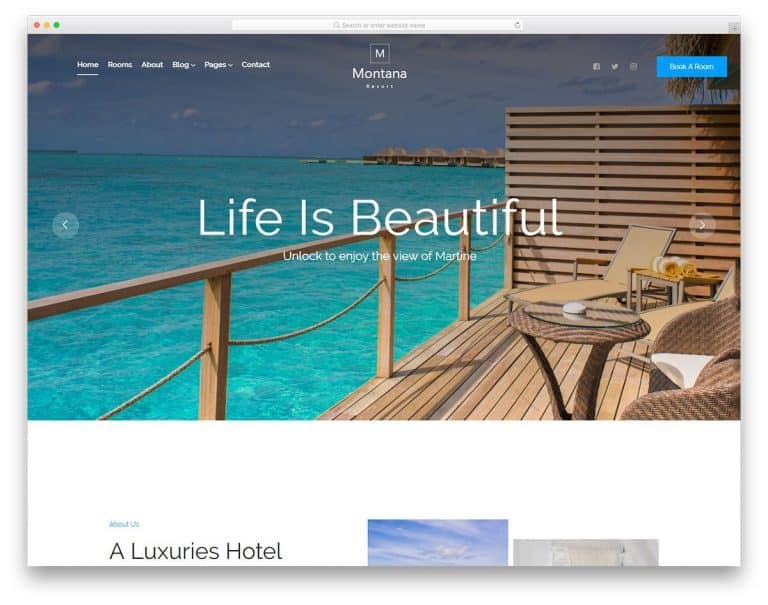
The width and height of the screenshot is (768, 605). I want to click on table, so click(x=601, y=329).